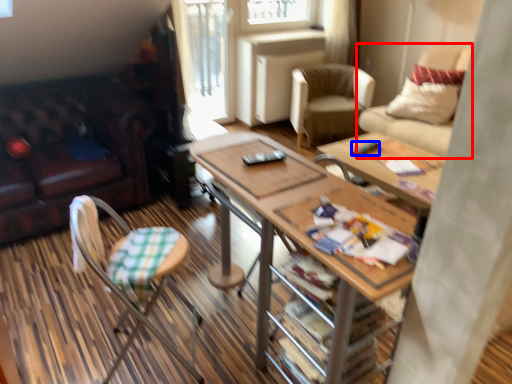
Question: Which point is closer to the camera, chair (highlighted by a red box) or remote control (highlighted by a blue box)?

Choices:
 (A) chair
 (B) remote control

Answer: (B)